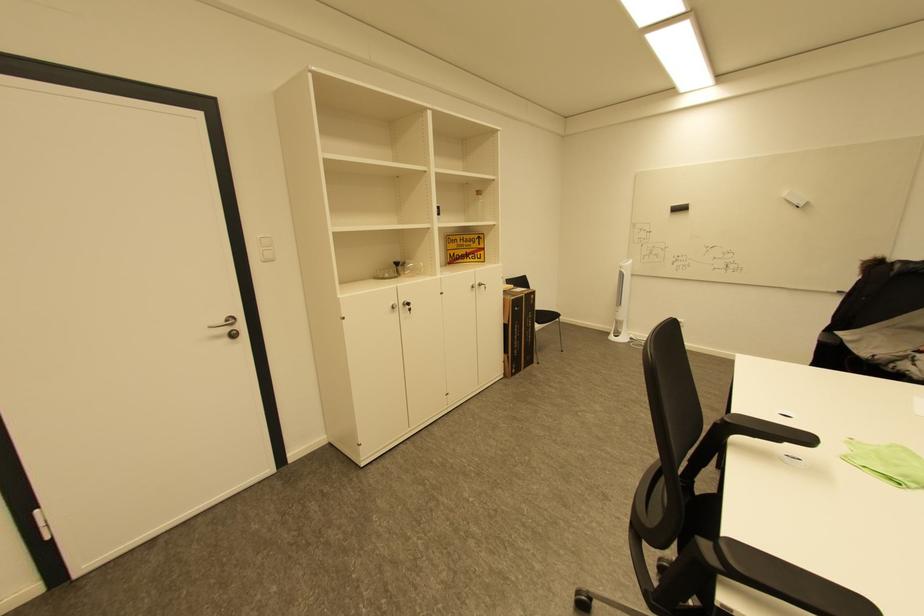
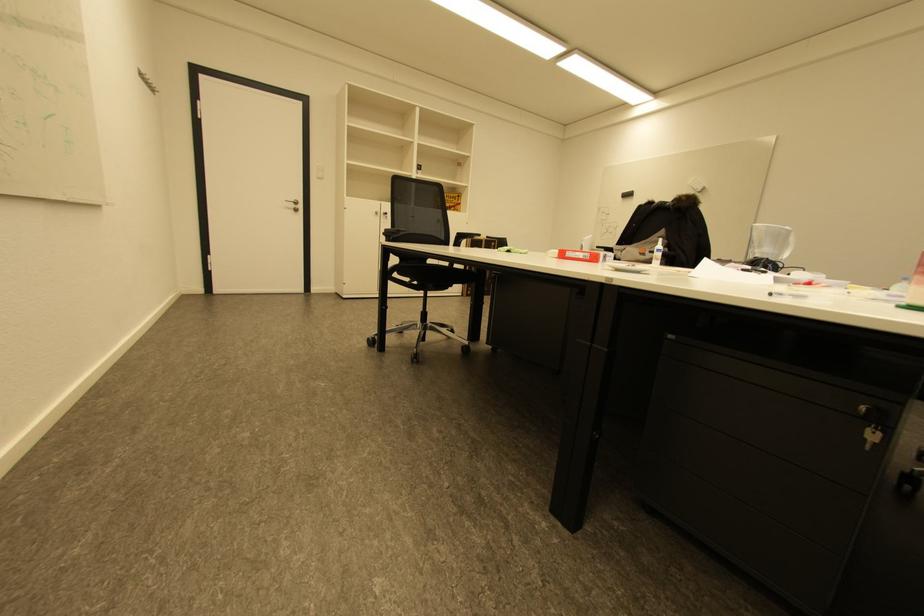
Which direction would the cameraman need to move to produce the second image?

The cameraman moved toward right, backward.